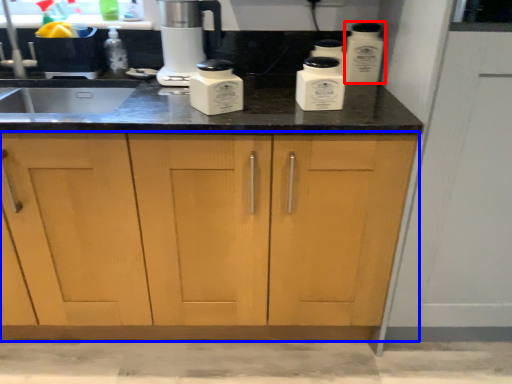
Question: Which object appears closest to the camera in this image, kitchen appliance (highlighted by a red box) or cabinetry (highlighted by a blue box)?

Choices:
 (A) kitchen appliance
 (B) cabinetry

Answer: (B)